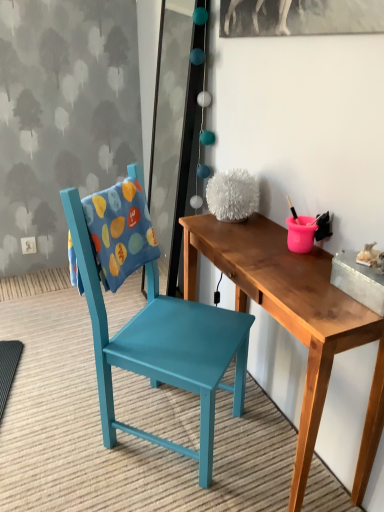
Where is `free point below wooden table at center (from a real-world perspective)`? free point below wooden table at center (from a real-world perspective) is located at coordinates (271, 444).